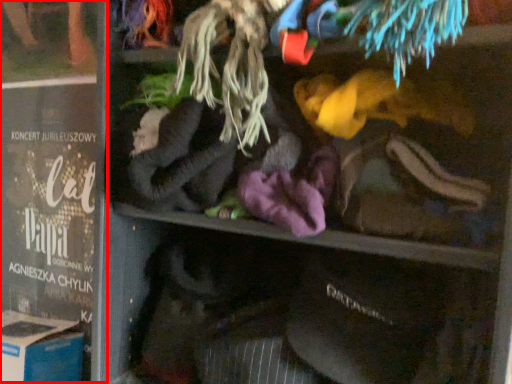
Question: In this image, where is book (annotated by the red box) located relative to cardboard box?

Choices:
 (A) left
 (B) right

Answer: (B)